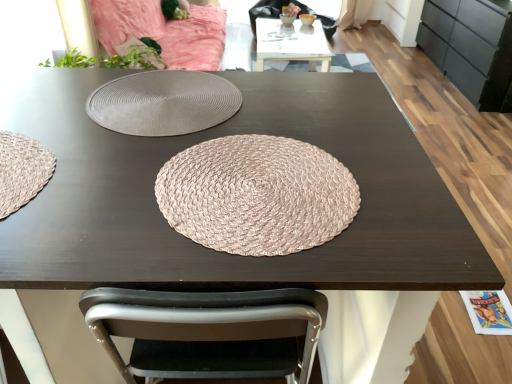
What is the approximate width of matte black dresser at right?

19.31 inches.

What do you see at coordinates (163, 103) in the screenshot?
I see `matte gray placemat at center` at bounding box center [163, 103].

Find the location of a particular element. pink woven mat at center is located at coordinates (x=257, y=195).

Considering the relative sizes of matte black dresser at right and white glossy table at upper center in the image provided, is matte black dresser at right wider than white glossy table at upper center?

No, matte black dresser at right is not wider than white glossy table at upper center.

Can you confirm if matte black dresser at right is bigger than white glossy table at upper center?

Indeed, matte black dresser at right has a larger size compared to white glossy table at upper center.

From the picture: Is matte black dresser at right facing away from white glossy table at upper center?

matte black dresser at right does not have its back to white glossy table at upper center.

Based on the photo, from a real-world perspective, is matte black dresser at right physically located above or below pink woven mat at center?

matte black dresser at right is below pink woven mat at center.

Does matte black dresser at right lie behind pink woven mat at center?

Yes, matte black dresser at right is further from the viewer.

The image size is (512, 384). I want to click on cabinetry behind the pink woven mat at center, so click(x=471, y=46).

Considering the relative sizes of matte black dresser at right and pink woven mat at center in the image provided, is matte black dresser at right smaller than pink woven mat at center?

No, matte black dresser at right is not smaller than pink woven mat at center.

Is matte gray placemat at center at the right side of pink woven mat at center?

In fact, matte gray placemat at center is to the left of pink woven mat at center.

Does matte gray placemat at center contain pink woven mat at center?

No, pink woven mat at center is not a part of matte gray placemat at center.

Between matte gray placemat at center and pink woven mat at center, which one has smaller size?

With smaller size is pink woven mat at center.

Considering the positions of objects matte gray placemat at center and pink woven mat at center in the image provided, who is in front, matte gray placemat at center or pink woven mat at center?

pink woven mat at center is in front.

Based on the photo, considering the relative positions of white glossy table at upper center and matte black dresser at right in the image provided, is white glossy table at upper center in front of matte black dresser at right?

That is False.

Considering the sizes of objects white glossy table at upper center and matte black dresser at right in the image provided, who is smaller, white glossy table at upper center or matte black dresser at right?

white glossy table at upper center is smaller.

Where is `table that is below the matte black dresser at right (from the image's perspective)`? table that is below the matte black dresser at right (from the image's perspective) is located at coordinates (292, 43).

From a real-world perspective, which is physically above, pink woven mat at center or matte black dresser at right?

pink woven mat at center is physically above.

Is pink woven mat at center at the left side of matte black dresser at right?

Correct, you'll find pink woven mat at center to the left of matte black dresser at right.

Is pink woven mat at center positioned in front of matte black dresser at right?

Yes, the depth of pink woven mat at center is less than that of matte black dresser at right.

In terms of width, does pink woven mat at center look wider or thinner when compared to matte black dresser at right?

In the image, pink woven mat at center appears to be more narrow than matte black dresser at right.

Considering the relative sizes of pink woven mat at center and matte gray placemat at center in the image provided, is pink woven mat at center smaller than matte gray placemat at center?

Yes, pink woven mat at center is smaller than matte gray placemat at center.

Looking at this image, is pink woven mat at center facing towards matte gray placemat at center?

Yes, pink woven mat at center is facing matte gray placemat at center.

Is matte gray placemat at center inside pink woven mat at center?

No, matte gray placemat at center is not inside pink woven mat at center.

Which is closer, [234,112] or [470,28]?

The point [234,112] is more forward.

Is matte black dresser at right at the back of matte gray placemat at center?

matte gray placemat at center does not have its back to matte black dresser at right.

At what (x,y) coordinates should I click in order to perform the action: click on cabinetry that appears in front of the white glossy table at upper center. Please return your answer as a coordinate pair (x, y). Looking at the image, I should click on (471, 46).

Locate an element on the screen. mat located on the left of matte black dresser at right is located at coordinates (257, 195).

Estimate the real-world distances between objects in this image. Which object is further from matte gray placemat at center, matte black dresser at right or white glossy table at upper center?

Among the two, matte black dresser at right is located further to matte gray placemat at center.

Based on their spatial positions, is white glossy table at upper center or pink woven mat at center further from matte gray placemat at center?

white glossy table at upper center lies further to matte gray placemat at center than the other object.

Considering their positions, is matte gray placemat at center positioned closer to white glossy table at upper center than pink woven mat at center?

Among the two, matte gray placemat at center is located nearer to white glossy table at upper center.

Which object lies nearer to the anchor point white glossy table at upper center, pink woven mat at center or matte gray placemat at center?

matte gray placemat at center lies closer to white glossy table at upper center than the other object.

Based on the photo, from the image, which object appears to be nearer to white glossy table at upper center, matte black dresser at right or pink woven mat at center?

matte black dresser at right lies closer to white glossy table at upper center than the other object.

Which object lies further to the anchor point pink woven mat at center, white glossy table at upper center or matte black dresser at right?

matte black dresser at right lies further to pink woven mat at center than the other object.

Estimate the real-world distances between objects in this image. Which object is further from matte black dresser at right, white glossy table at upper center or pink woven mat at center?

pink woven mat at center lies further to matte black dresser at right than the other object.

Considering their positions, is white glossy table at upper center positioned further to matte gray placemat at center than matte black dresser at right?

matte black dresser at right is positioned further to the anchor matte gray placemat at center.

You are a GUI agent. You are given a task and a screenshot of the screen. Output one action in this format:
    pyautogui.click(x=<x>, y=<y>)
    Task: Click on the cabinetry between matte gray placemat at center and white glossy table at upper center in the front-back direction
    
    Given the screenshot: What is the action you would take?
    pyautogui.click(x=471, y=46)

Where is `cabinetry positioned between pink woven mat at center and white glossy table at upper center from near to far`? The image size is (512, 384). cabinetry positioned between pink woven mat at center and white glossy table at upper center from near to far is located at coordinates (471, 46).

Where is `plate between pink woven mat at center and matte black dresser at right along the z-axis`? plate between pink woven mat at center and matte black dresser at right along the z-axis is located at coordinates (163, 103).

Find the location of `plate between pink woven mat at center and white glossy table at upper center from front to back`. plate between pink woven mat at center and white glossy table at upper center from front to back is located at coordinates (163, 103).